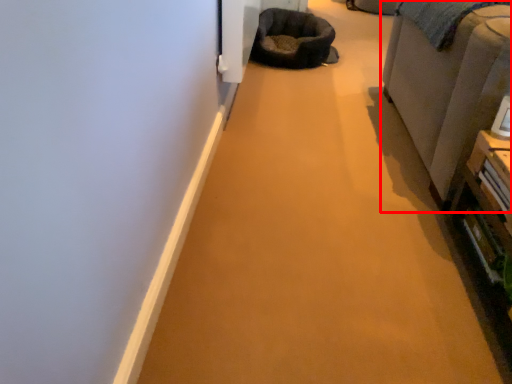
Question: From the image, what is the correct spatial relationship of furniture (annotated by the red box) in relation to bean bag chair?

Choices:
 (A) left
 (B) right

Answer: (B)